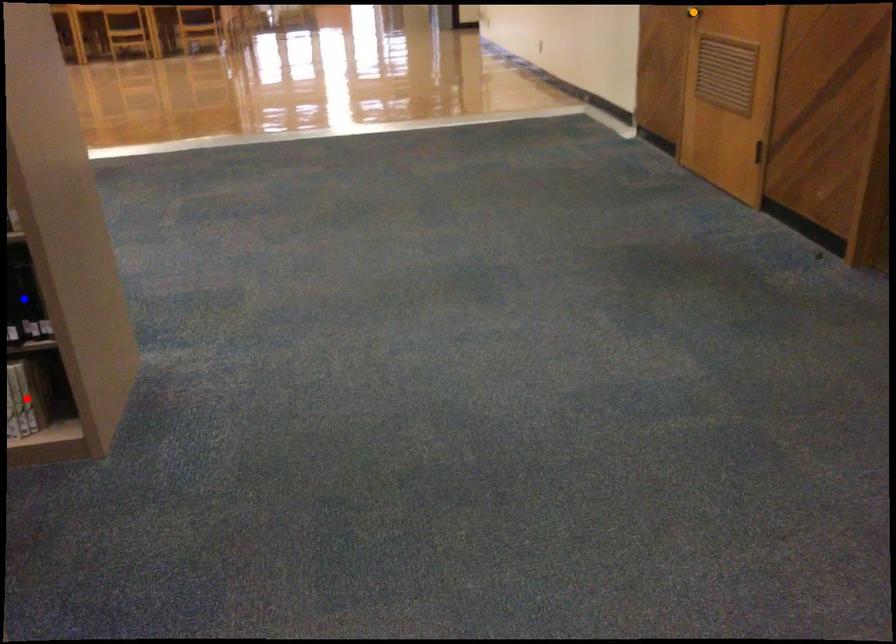
Order these from nearest to farthest:
A) blue point
B) red point
C) orange point

blue point
red point
orange point